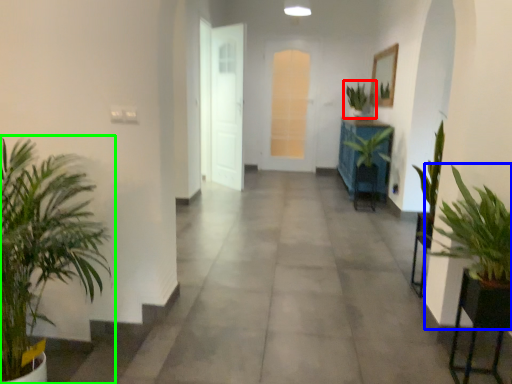
Question: Which is farther away from houseplant (highlighted by a red box)? houseplant (highlighted by a blue box) or houseplant (highlighted by a green box)?

Choices:
 (A) houseplant
 (B) houseplant

Answer: (B)